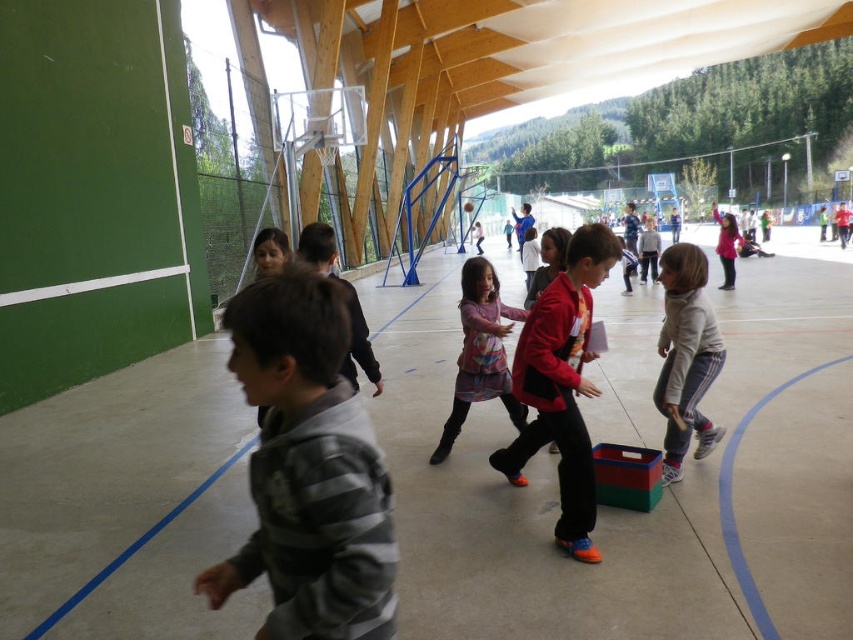
Does red matte jacket at center have a greater height compared to matte pink sweater at center?

No, red matte jacket at center is not taller than matte pink sweater at center.

Measure the distance between point (578,342) and camera.

A distance of 3.11 meters exists between point (578,342) and camera.

Where is `red matte jacket at center`? The image size is (853, 640). red matte jacket at center is located at coordinates (561, 385).

In the scene shown: Measure the distance between point (561, 278) and camera.

They are 10.14 feet apart.

Does red matte jacket at center appear on the right side of white fleece jacket at center?

Incorrect, red matte jacket at center is not on the right side of white fleece jacket at center.

At what (x,y) coordinates should I click in order to perform the action: click on red matte jacket at center. Please return your answer as a coordinate pair (x, y). Image resolution: width=853 pixels, height=640 pixels. Looking at the image, I should click on (561, 385).

Image resolution: width=853 pixels, height=640 pixels. What are the coordinates of `red matte jacket at center` in the screenshot? It's located at (561, 385).

Describe the element at coordinates (308, 468) in the screenshot. I see `striped cotton shirt at center` at that location.

Which is more to the right, striped cotton shirt at center or matte pink sweater at center?

Positioned to the right is matte pink sweater at center.

What are the coordinates of `striped cotton shirt at center` in the screenshot? It's located at (308, 468).